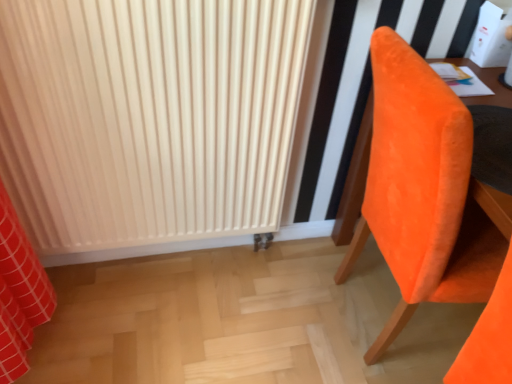
Question: Based on their sizes in the image, would you say matte white radiator at center is bigger or smaller than orange velvet chair at right?

Choices:
 (A) big
 (B) small

Answer: (B)

Question: Is matte white radiator at center taller or shorter than orange velvet chair at right?

Choices:
 (A) short
 (B) tall

Answer: (B)

Question: Considering the positions of matte white radiator at center and orange velvet chair at right in the image, is matte white radiator at center wider or thinner than orange velvet chair at right?

Choices:
 (A) thin
 (B) wide

Answer: (A)

Question: In the image, is orange velvet chair at right positioned in front of or behind matte white radiator at center?

Choices:
 (A) front
 (B) behind

Answer: (A)

Question: From the image's perspective, relative to matte white radiator at center, is orange velvet chair at right above or below?

Choices:
 (A) above
 (B) below

Answer: (B)

Question: Is orange velvet chair at right inside or outside of matte white radiator at center?

Choices:
 (A) inside
 (B) outside

Answer: (B)

Question: Visually, is orange velvet chair at right positioned to the left or to the right of matte white radiator at center?

Choices:
 (A) left
 (B) right

Answer: (B)